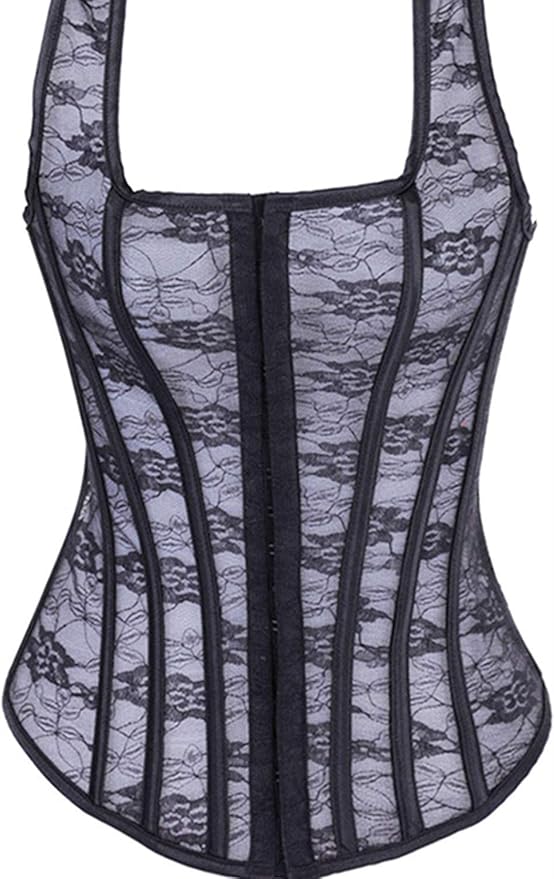
The height and width of the screenshot is (879, 554). What are the coordinates of `trim` in the screenshot? It's located at (138, 844).